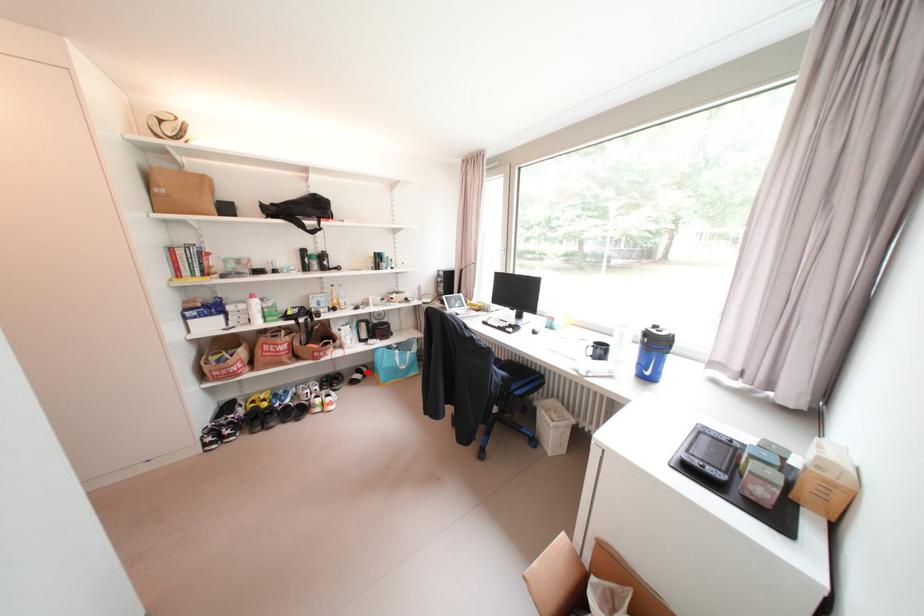
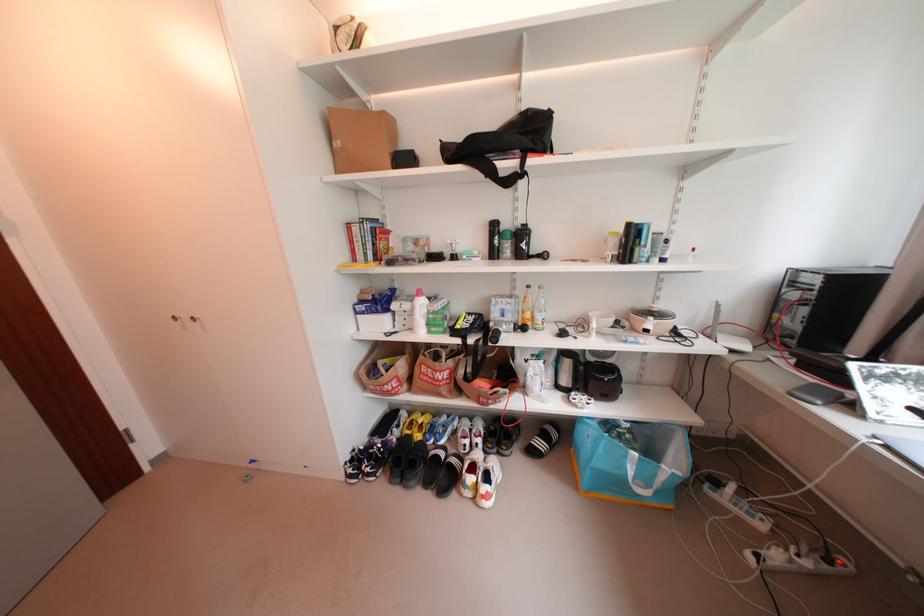
Question: A red point is marked in image1. In image2, is the corresponding 3D point closer to the camera or farther? Reply with the corresponding letter.

Choices:
 (A) The corresponding 3D point is closer.
 (B) The corresponding 3D point is farther.

Answer: (B)